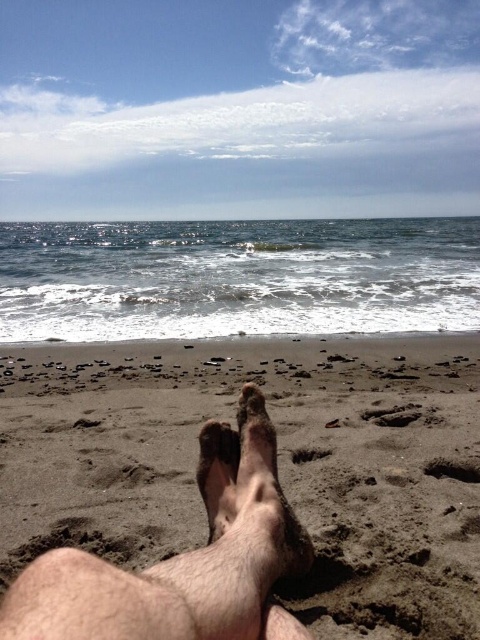
You are standing on the beach and see your two feet in the image. Which foot is closer to you, the brown sandy feet at lower center or the dry sand foot at center?

The brown sandy feet at lower center is closer to you because it is further to the viewer than the dry sand foot at center.

You are standing on a beach and see your brown sandy feet at lower center. Where exactly are your feet located in relation to the shoreline?

The brown sandy feet at lower center are located at coordinates point (278, 465), which is on the sandy shore near the shoreline where the wet sand meets the incoming waves.

You are standing on the beach and see two points marked on the sand. The first point is at coordinates point (130,538) and the second is at point (231,518). Which point is closer to your feet?

Point (130,538) is closer to your feet because it is further to the camera than point (231,518), meaning it is nearer to the observer.